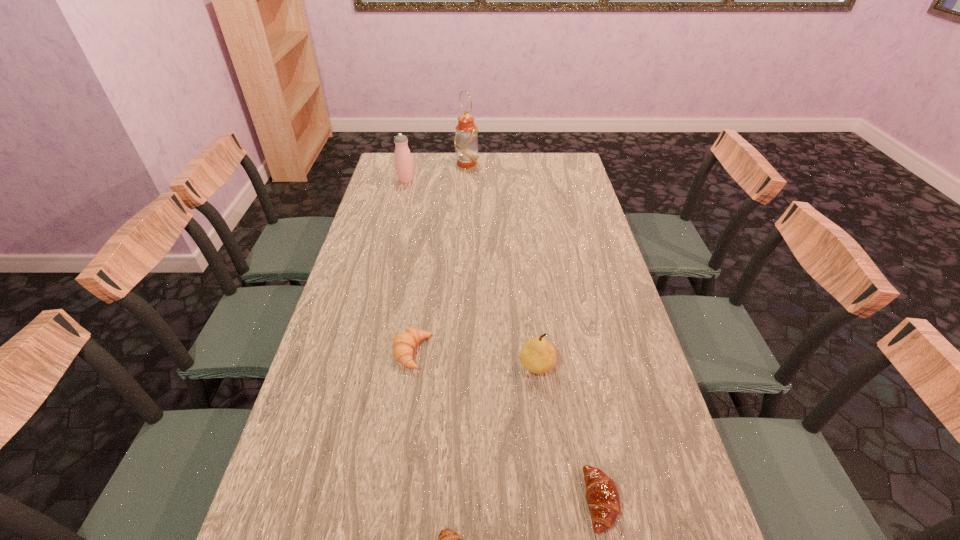
I want to click on free spot located on the back of the leftmost object, so click(411, 160).

At what (x,y) coordinates should I click in order to perform the action: click on free space located 0.190m on the right of the pear. Please return your answer as a coordinate pair (x, y). The width and height of the screenshot is (960, 540). Looking at the image, I should click on (627, 366).

Identify the location of free spot located 0.150m on the left of the fifth object from right to left. The height and width of the screenshot is (540, 960). (338, 353).

Find the location of a particular element. The height and width of the screenshot is (540, 960). free space located 0.140m on the left of the rightmost object is located at coordinates (516, 501).

The width and height of the screenshot is (960, 540). I want to click on oil lamp positioned at the far edge, so click(x=466, y=136).

Locate an element on the screen. The width and height of the screenshot is (960, 540). thermos bottle situated at the far edge is located at coordinates (403, 161).

Locate an element on the screen. This screenshot has height=540, width=960. object positioned at the left edge is located at coordinates (403, 161).

Where is `object situated at the right edge`? This screenshot has width=960, height=540. object situated at the right edge is located at coordinates (602, 495).

You are a GUI agent. You are given a task and a screenshot of the screen. Output one action in this format:
    pyautogui.click(x=<x>, y=<y>)
    Task: Click on the object present at the far left corner
    This screenshot has width=960, height=540.
    Given the screenshot: What is the action you would take?
    pyautogui.click(x=403, y=161)

Identify the location of vacant space at the far edge of the desktop. The width and height of the screenshot is (960, 540). (529, 160).